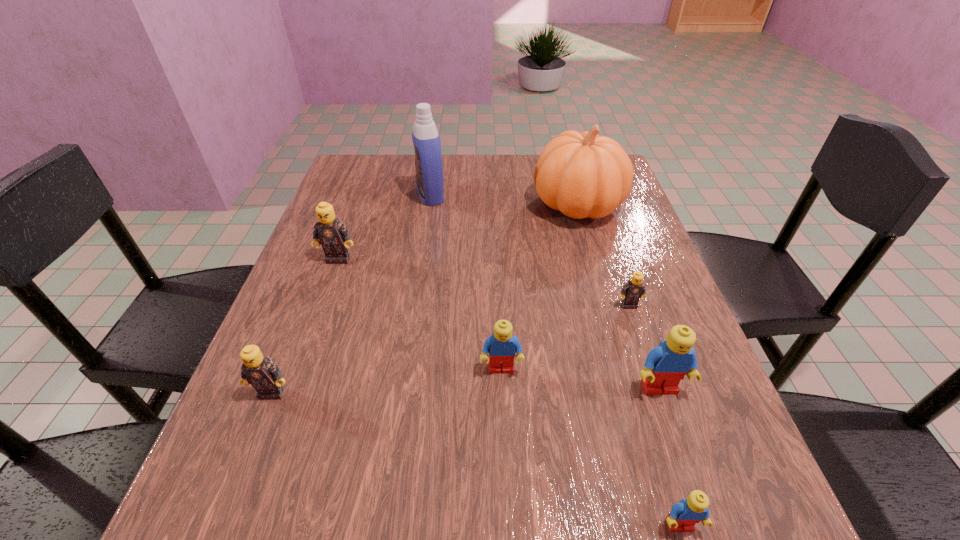
At what (x,y) coordinates should I click in order to perform the action: click on the rightmost tan Lego. Please return your answer as a coordinate pair (x, y). Looking at the image, I should click on (634, 289).

You are a GUI agent. You are given a task and a screenshot of the screen. Output one action in this format:
    pyautogui.click(x=<x>, y=<y>)
    Task: Click on the nearest object
    
    Given the screenshot: What is the action you would take?
    pyautogui.click(x=684, y=515)

What are the coordinates of `the smallest blue Lego` in the screenshot? It's located at (684, 515).

Where is `vacant space located on the front of the third object from left to right`? The height and width of the screenshot is (540, 960). vacant space located on the front of the third object from left to right is located at coordinates (414, 308).

The width and height of the screenshot is (960, 540). Identify the location of free space located on the left of the pumpkin. (471, 205).

Image resolution: width=960 pixels, height=540 pixels. Identify the location of vacant space located 0.090m on the face of the biggest blue Lego. (682, 451).

At what (x,y) coordinates should I click in order to perform the action: click on vacant space located in front of the farthest tan Lego. Please return your answer as a coordinate pair (x, y). The image size is (960, 540). Looking at the image, I should click on (287, 401).

This screenshot has height=540, width=960. Find the location of `vacant space located on the face of the leftmost blue Lego`. vacant space located on the face of the leftmost blue Lego is located at coordinates (503, 408).

Find the location of a particular element. vacant space located 0.060m in front of the nearest tan Lego is located at coordinates click(x=256, y=433).

Locate an element on the screen. The width and height of the screenshot is (960, 540). blank space located in front of the fifth nearest Lego is located at coordinates (687, 479).